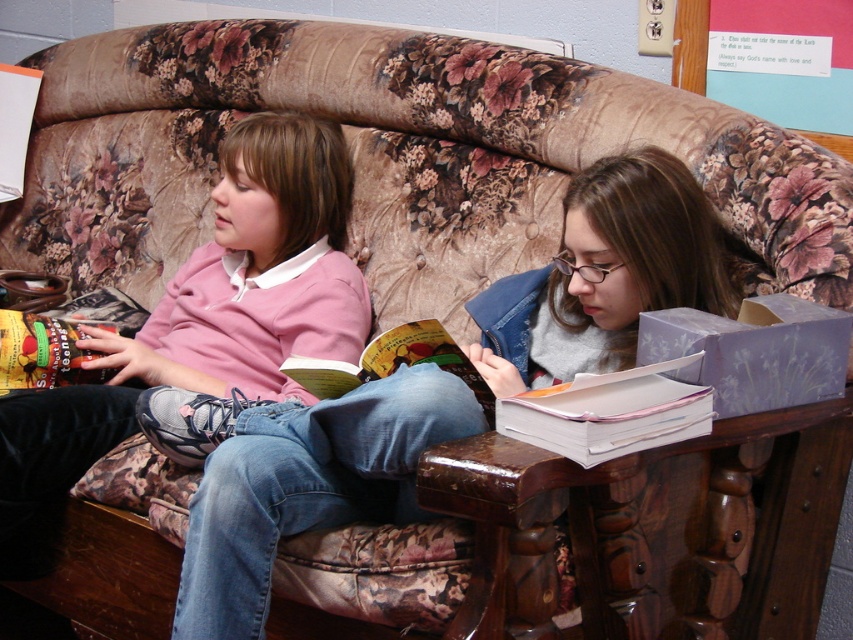
Is pink cotton shirt at left shorter than white paper book at lower right?

In fact, pink cotton shirt at left may be taller than white paper book at lower right.

Which is in front, point (274, 272) or point (613, 448)?

Point (613, 448)

Which is behind, point (0, 476) or point (622, 392)?

Positioned behind is point (0, 476).

Find the location of a particular element. This screenshot has width=853, height=640. pink cotton shirt at left is located at coordinates (206, 317).

Measure the distance between point [519,422] and camera.

1.03 meters

Between white paper book at lower right and hardcover book at center, which one is positioned lower?

white paper book at lower right

Describe the element at coordinates (608, 412) in the screenshot. Image resolution: width=853 pixels, height=640 pixels. I see `white paper book at lower right` at that location.

Where is `white paper book at lower right`? The width and height of the screenshot is (853, 640). white paper book at lower right is located at coordinates (608, 412).

Based on the photo, is pink cotton shirt at left thinner than hardcover book at center?

Incorrect, pink cotton shirt at left's width is not less than hardcover book at center's.

Does point (183, 380) lie in front of point (438, 324)?

No.

Is point (219, 385) less distant than point (397, 360)?

No, (219, 385) is behind (397, 360).

I want to click on pink cotton shirt at left, so click(206, 317).